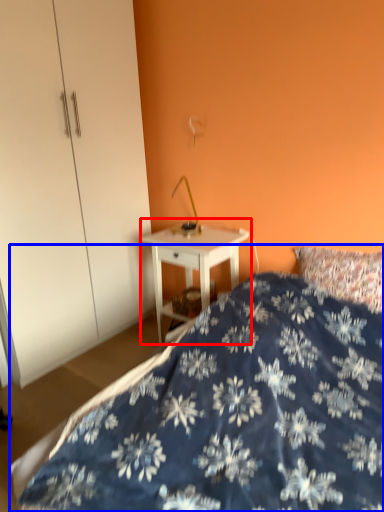
Question: Which point is closer to the camera, nightstand (highlighted by a red box) or bed (highlighted by a blue box)?

Choices:
 (A) nightstand
 (B) bed

Answer: (B)